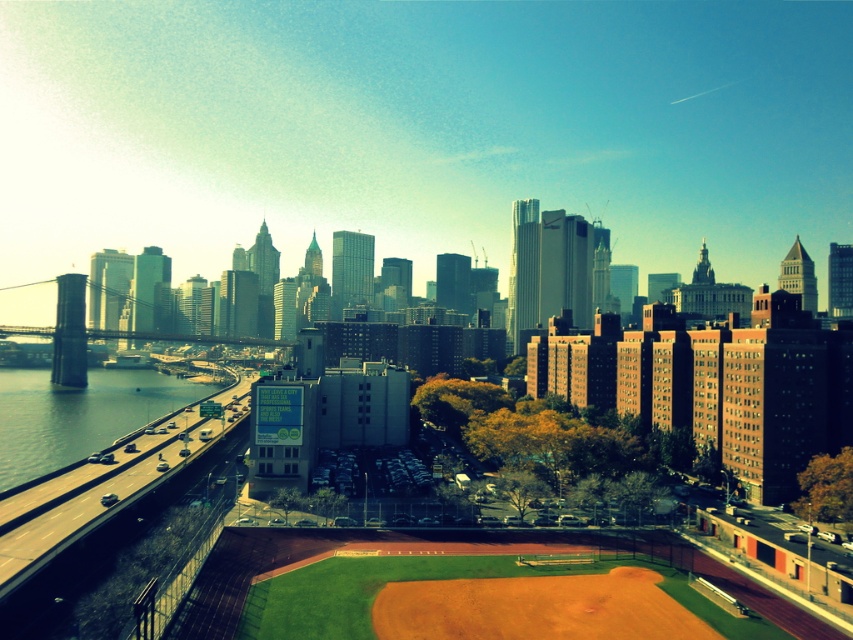
Question: From the image, what is the correct spatial relationship of brown dirt field at center in relation to clear water at bridge left?

Choices:
 (A) below
 (B) above

Answer: (B)

Question: Does brown dirt field at center appear over clear water at bridge left?

Choices:
 (A) no
 (B) yes

Answer: (B)

Question: Is brown dirt field at center further to camera compared to clear water at bridge left?

Choices:
 (A) yes
 (B) no

Answer: (B)

Question: Which point appears farthest from the camera in this image?

Choices:
 (A) (115, 420)
 (B) (704, 332)

Answer: (A)

Question: Which point appears farthest from the camera in this image?

Choices:
 (A) (813, 332)
 (B) (50, 435)

Answer: (B)

Question: Among these points, which one is farthest from the camera?

Choices:
 (A) (4, 424)
 (B) (560, 381)

Answer: (B)